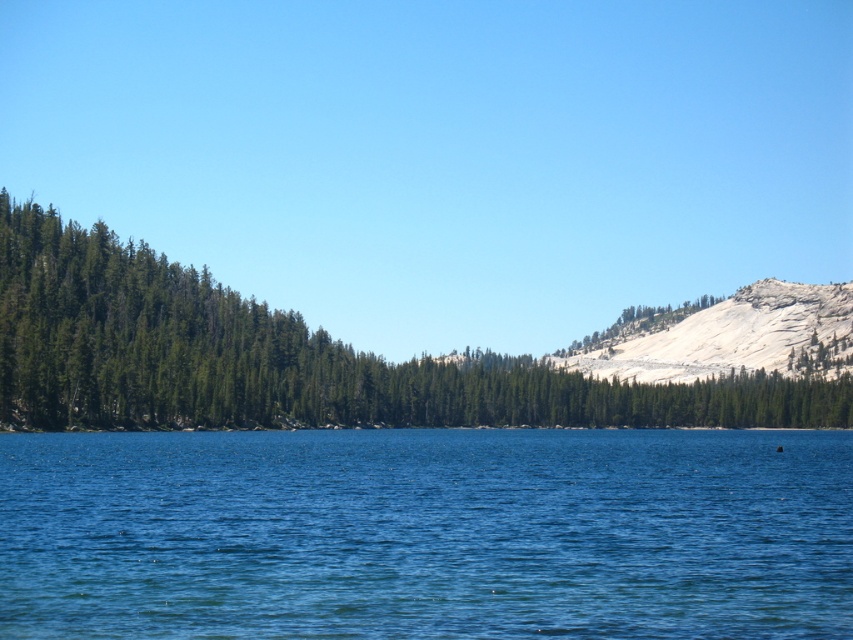
You are a hiker planning to cross from the green matte trees at left to the blue liquid water at center. Which direction should you move towards?

You should move towards the right direction because the blue liquid water at center is positioned on the right side of green matte trees at left.